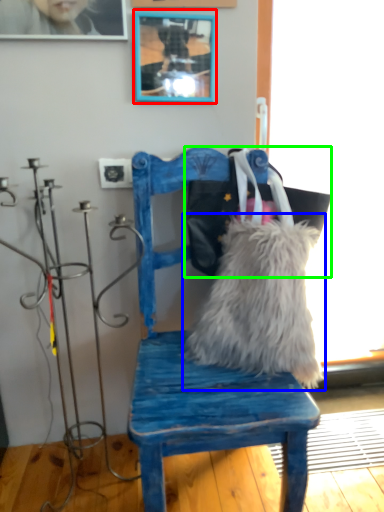
Question: Considering the real-world distances, which object is farthest from picture frame (highlighted by a red box)? pillow (highlighted by a blue box) or messenger bag (highlighted by a green box)?

Choices:
 (A) pillow
 (B) messenger bag

Answer: (A)